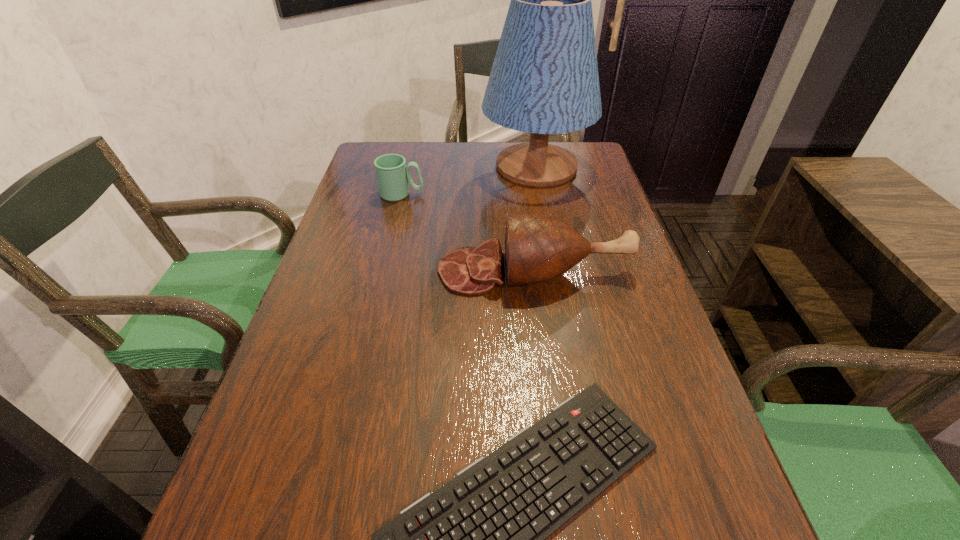
Where is `the tallest object`? the tallest object is located at coordinates (544, 80).

Locate an element on the screen. The height and width of the screenshot is (540, 960). the second nearest object is located at coordinates click(x=538, y=248).

Identify the location of the second tallest object. This screenshot has width=960, height=540. (538, 248).

This screenshot has width=960, height=540. In order to click on the third tallest object in this screenshot , I will do `click(393, 176)`.

Locate an element on the screen. the leftmost object is located at coordinates (393, 176).

Identify the location of vacant point located on the front of the tallest object. (553, 260).

This screenshot has height=540, width=960. In order to click on free region located 0.220m at the sliced end of the ham in this screenshot , I will do `click(345, 271)`.

Image resolution: width=960 pixels, height=540 pixels. Find the location of `vacant position located 0.060m at the sliced end of the ham`. vacant position located 0.060m at the sliced end of the ham is located at coordinates (413, 271).

Image resolution: width=960 pixels, height=540 pixels. Find the location of `vacant space located 0.170m at the sliced end of the ham`. vacant space located 0.170m at the sliced end of the ham is located at coordinates (366, 271).

Locate an element on the screen. Image resolution: width=960 pixels, height=540 pixels. free location located 0.050m on the side of the second shortest object with the handle is located at coordinates pos(441,194).